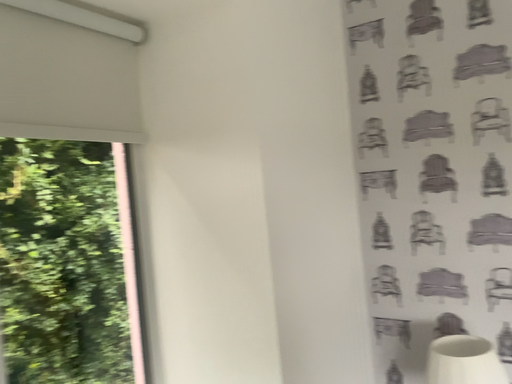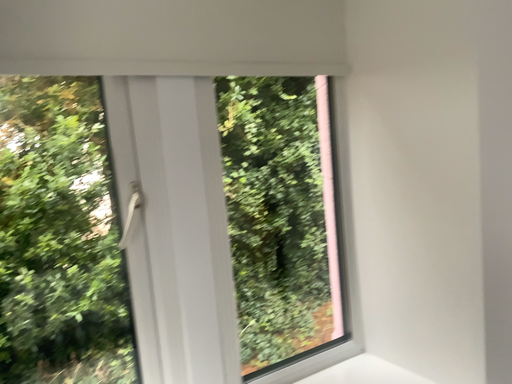
Question: How did the camera likely rotate when shooting the video?

Choices:
 (A) rotated right
 (B) rotated left

Answer: (B)